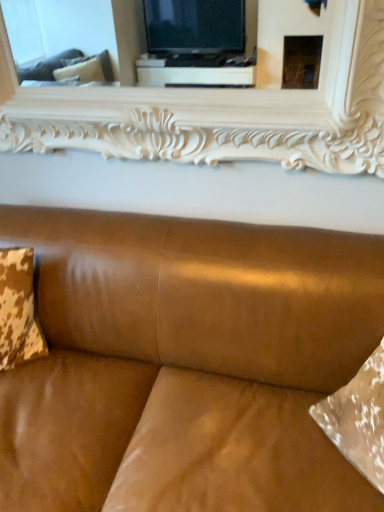
Find the location of `satin brown leather couch at center`. satin brown leather couch at center is located at coordinates (186, 364).

Which object is positioned more to the left, cowhide fabric pillow at left or satin brown leather couch at center?

cowhide fabric pillow at left.

From a real-world perspective, is cowhide fabric pillow at left beneath satin brown leather couch at center?

Incorrect, from a real-world perspective, cowhide fabric pillow at left is higher than satin brown leather couch at center.

Which of these two, cowhide fabric pillow at left or satin brown leather couch at center, is thinner?

With smaller width is cowhide fabric pillow at left.

Can you confirm if cowhide fabric pillow at left is bigger than satin brown leather couch at center?

No.

Considering their positions, is white carved wood mirror at upper center located in front of or behind satin brown leather couch at center?

In the image, white carved wood mirror at upper center appears behind satin brown leather couch at center.

Does white carved wood mirror at upper center have a larger size compared to satin brown leather couch at center?

Actually, white carved wood mirror at upper center might be smaller than satin brown leather couch at center.

Locate an element on the screen. The height and width of the screenshot is (512, 384). studio couch in front of the white carved wood mirror at upper center is located at coordinates (186, 364).

Considering the relative sizes of white carved wood mirror at upper center and satin brown leather couch at center in the image provided, is white carved wood mirror at upper center thinner than satin brown leather couch at center?

Yes, white carved wood mirror at upper center is thinner than satin brown leather couch at center.

Is white carved wood mirror at upper center outside of cowhide fabric pillow at left?

Yes, white carved wood mirror at upper center is outside of cowhide fabric pillow at left.

Is white carved wood mirror at upper center bigger or smaller than cowhide fabric pillow at left?

white carved wood mirror at upper center is bigger than cowhide fabric pillow at left.

From the picture: Between white carved wood mirror at upper center and cowhide fabric pillow at left, which one is positioned in front?

white carved wood mirror at upper center is in front.

Is white carved wood mirror at upper center taller or shorter than cowhide fabric pillow at left?

In the image, white carved wood mirror at upper center appears to be taller than cowhide fabric pillow at left.

From a real-world perspective, who is located higher, satin brown leather couch at center or white carved wood mirror at upper center?

white carved wood mirror at upper center is physically above.

Considering the points (99, 273) and (132, 148), which point is in front, point (99, 273) or point (132, 148)?

Positioned in front is point (99, 273).

Is satin brown leather couch at center situated inside white carved wood mirror at upper center or outside?

satin brown leather couch at center cannot be found inside white carved wood mirror at upper center.

Based on the photo, is satin brown leather couch at center completely or partially outside of cowhide fabric pillow at left?

That's correct, satin brown leather couch at center is outside of cowhide fabric pillow at left.

Image resolution: width=384 pixels, height=512 pixels. Find the location of `studio couch below the cowhide fabric pillow at left (from a real-world perspective)`. studio couch below the cowhide fabric pillow at left (from a real-world perspective) is located at coordinates (186, 364).

Is satin brown leather couch at center in front of or behind cowhide fabric pillow at left in the image?

Clearly, satin brown leather couch at center is in front of cowhide fabric pillow at left.

Is cowhide fabric pillow at left in front of or behind white carved wood mirror at upper center in the image?

cowhide fabric pillow at left is behind white carved wood mirror at upper center.

Is point (3, 332) closer to viewer compared to point (317, 80)?

That is True.

From a real-world perspective, is cowhide fabric pillow at left physically above white carved wood mirror at upper center?

Actually, cowhide fabric pillow at left is physically below white carved wood mirror at upper center in the real world.

Is cowhide fabric pillow at left touching white carved wood mirror at upper center?

cowhide fabric pillow at left is not next to white carved wood mirror at upper center, and they're not touching.

The width and height of the screenshot is (384, 512). Identify the location of studio couch in front of the cowhide fabric pillow at left. (186, 364).

Locate an element on the screen. mirror above the satin brown leather couch at center (from a real-world perspective) is located at coordinates (197, 86).

When comparing their distances from white carved wood mirror at upper center, does satin brown leather couch at center or cowhide fabric pillow at left seem closer?

satin brown leather couch at center.

Estimate the real-world distances between objects in this image. Which object is further from cowhide fabric pillow at left, satin brown leather couch at center or white carved wood mirror at upper center?

white carved wood mirror at upper center.

Based on the photo, estimate the real-world distances between objects in this image. Which object is closer to satin brown leather couch at center, white carved wood mirror at upper center or cowhide fabric pillow at left?

cowhide fabric pillow at left.

When comparing their distances from satin brown leather couch at center, does cowhide fabric pillow at left or white carved wood mirror at upper center seem further?

The object further to satin brown leather couch at center is white carved wood mirror at upper center.

Which object lies nearer to the anchor point white carved wood mirror at upper center, cowhide fabric pillow at left or satin brown leather couch at center?

satin brown leather couch at center is closer to white carved wood mirror at upper center.

Estimate the real-world distances between objects in this image. Which object is further from cowhide fabric pillow at left, white carved wood mirror at upper center or satin brown leather couch at center?

white carved wood mirror at upper center lies further to cowhide fabric pillow at left than the other object.

Identify the location of pillow between white carved wood mirror at upper center and satin brown leather couch at center vertically. The height and width of the screenshot is (512, 384). (18, 310).